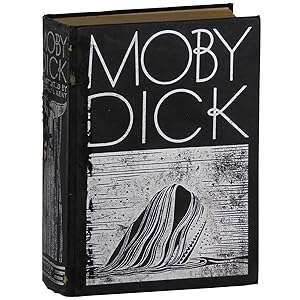
Find the location of a particular element. spine of book is located at coordinates (50, 173).